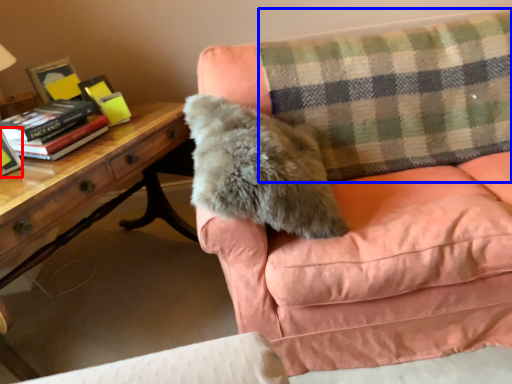
Question: Which of the following is the farthest to the observer, paperback book (highlighted by a red box) or plaid (highlighted by a blue box)?

Choices:
 (A) paperback book
 (B) plaid

Answer: (B)